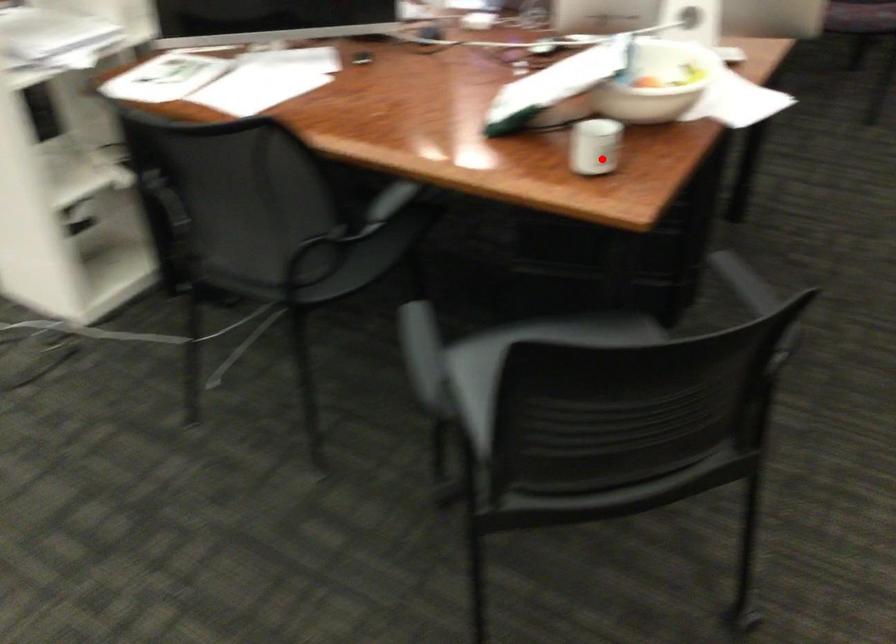
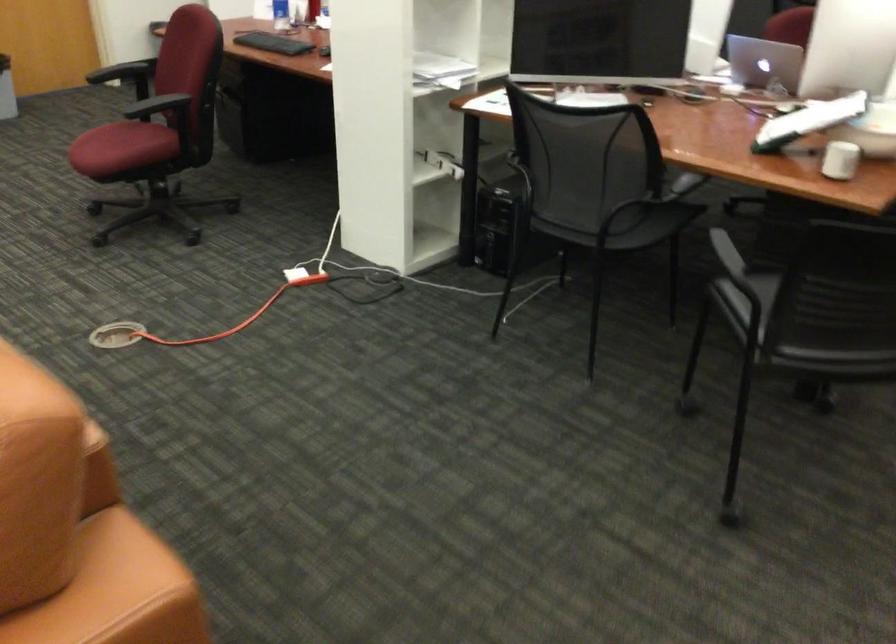
Where in the second image is the point corresponding to the highlighted location from the first image?

(840, 160)